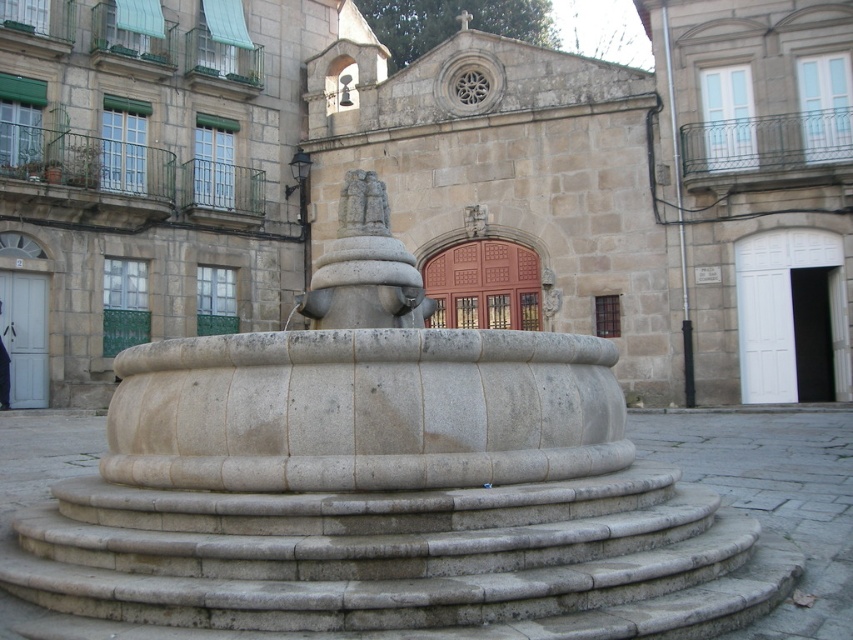
Question: Which object appears farthest from the camera in this image?

Choices:
 (A) smooth stone stairs at center
 (B) smooth stone fountain at center
 (C) gray stone statue at center

Answer: (C)

Question: Which point is closer to the camera?

Choices:
 (A) (344, 211)
 (B) (643, 611)

Answer: (B)

Question: Considering the real-world distances, which object is farthest from the gray stone statue at center?

Choices:
 (A) smooth stone stairs at center
 (B) smooth stone fountain at center

Answer: (B)

Question: Is smooth stone fountain at center smaller than gray stone statue at center?

Choices:
 (A) yes
 (B) no

Answer: (A)

Question: Is smooth stone fountain at center wider than smooth stone stairs at center?

Choices:
 (A) no
 (B) yes

Answer: (A)

Question: From the image, what is the correct spatial relationship of smooth stone stairs at center in relation to gray stone statue at center?

Choices:
 (A) left
 (B) right

Answer: (B)